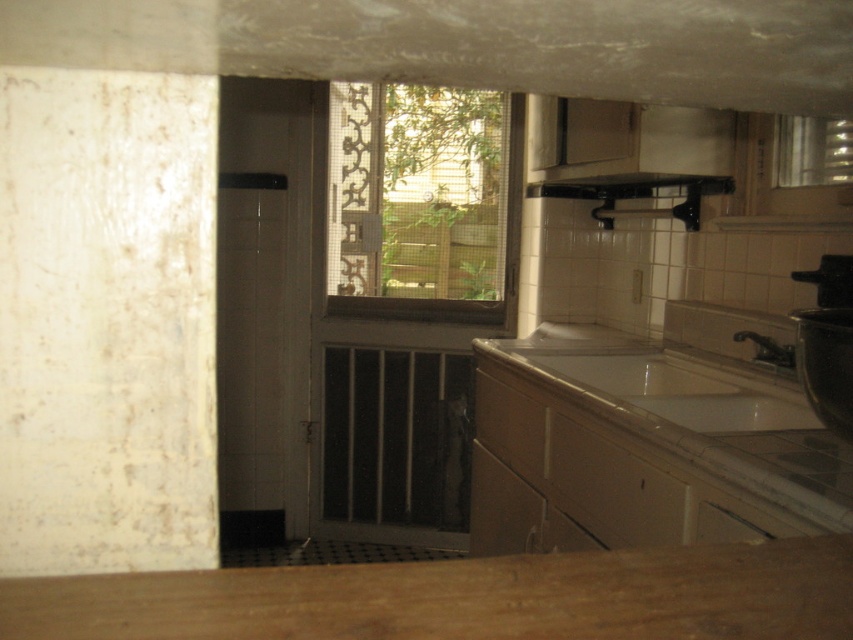
Can you confirm if wooden countertop at lower center is positioned to the left of white glossy sink at lower right?

Correct, you'll find wooden countertop at lower center to the left of white glossy sink at lower right.

Image resolution: width=853 pixels, height=640 pixels. What are the coordinates of `wooden countertop at lower center` in the screenshot? It's located at (463, 596).

Can you confirm if clear glass window at center is positioned above clear glass window at upper right?

Yes.

Does point (479, 180) come farther from viewer compared to point (817, 141)?

Yes.

Where is `clear glass window at center`? The width and height of the screenshot is (853, 640). clear glass window at center is located at coordinates coord(421,202).

Who is positioned more to the right, black matte exhaust hood at upper center or matte silver faucet at lower right?

From the viewer's perspective, matte silver faucet at lower right appears more on the right side.

Which is in front, point (708, 138) or point (782, 358)?

Point (782, 358) is more forward.

You are a GUI agent. You are given a task and a screenshot of the screen. Output one action in this format:
    pyautogui.click(x=<x>, y=<y>)
    Task: Click on the black matte exhaust hood at upper center
    This screenshot has width=853, height=640.
    Given the screenshot: What is the action you would take?
    pyautogui.click(x=630, y=152)